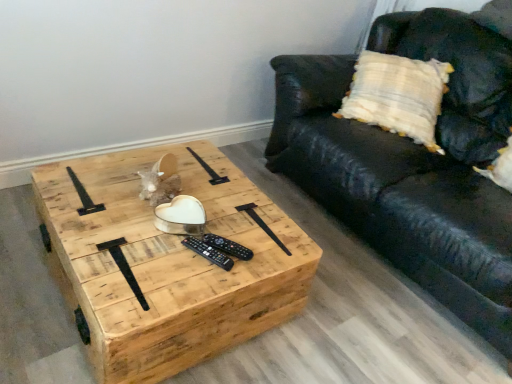
Image resolution: width=512 pixels, height=384 pixels. Identify the location of vacant space behind black plastic remote at center, the 2th remote in the back-to-front sequence. (218, 221).